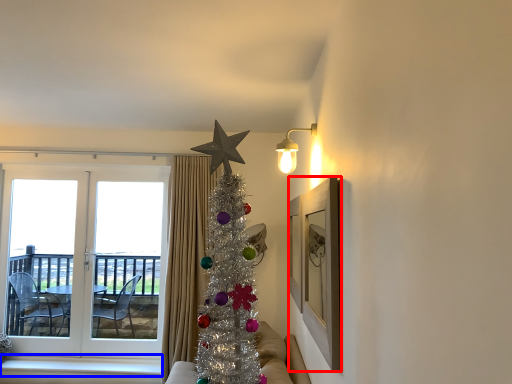
Question: Which point is further to the camera, picture frame (highlighted by a red box) or window sill (highlighted by a blue box)?

Choices:
 (A) picture frame
 (B) window sill

Answer: (B)